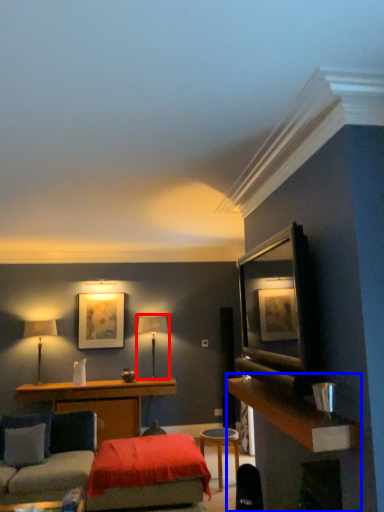
Question: Which of the following is the farthest to the observer, table lamp (highlighted by a red box) or dresser (highlighted by a blue box)?

Choices:
 (A) table lamp
 (B) dresser

Answer: (A)